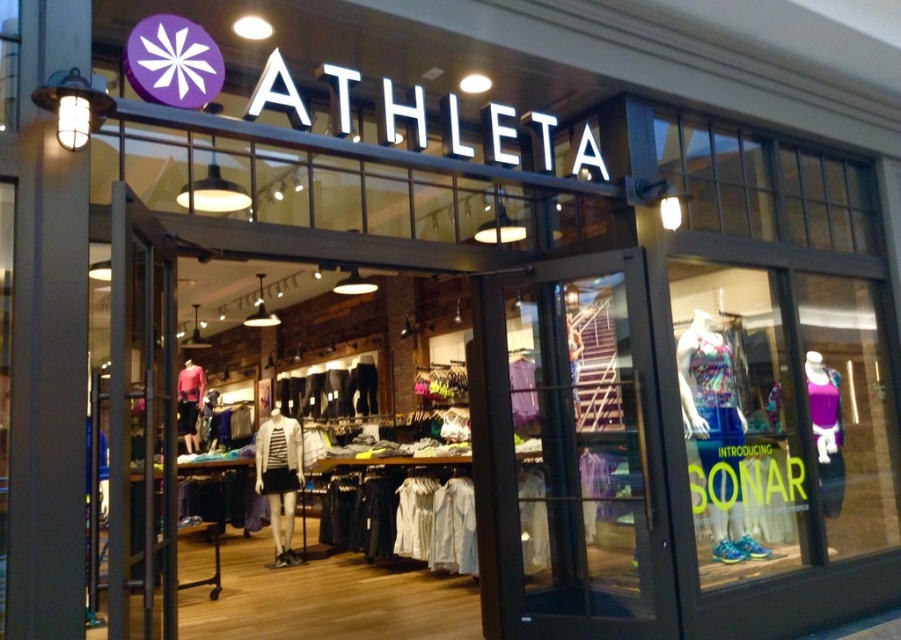
Question: Which object is positioned farthest from the matte red shirt at center?

Choices:
 (A) textured fabric dress at center
 (B) purple fabric dress at center

Answer: (A)

Question: Which point is farther from the camera taking this photo?

Choices:
 (A) (349, 413)
 (B) (818, 445)
 (C) (258, 468)

Answer: (A)

Question: Does purple fabric tank top at right appear over white striped shirt at center?

Choices:
 (A) yes
 (B) no

Answer: (A)

Question: Can you confirm if textured fabric dress at center is positioned to the right of purple fabric dress at center?

Choices:
 (A) no
 (B) yes

Answer: (B)

Question: Which of these objects is positioned farthest from the black matte leggings at center?

Choices:
 (A) purple fabric dress at center
 (B) textured fabric dress at center
 (C) purple fabric tank top at right
 (D) matte red shirt at center

Answer: (C)

Question: Does white striped shirt at center appear on the left side of purple fabric dress at center?

Choices:
 (A) yes
 (B) no

Answer: (A)